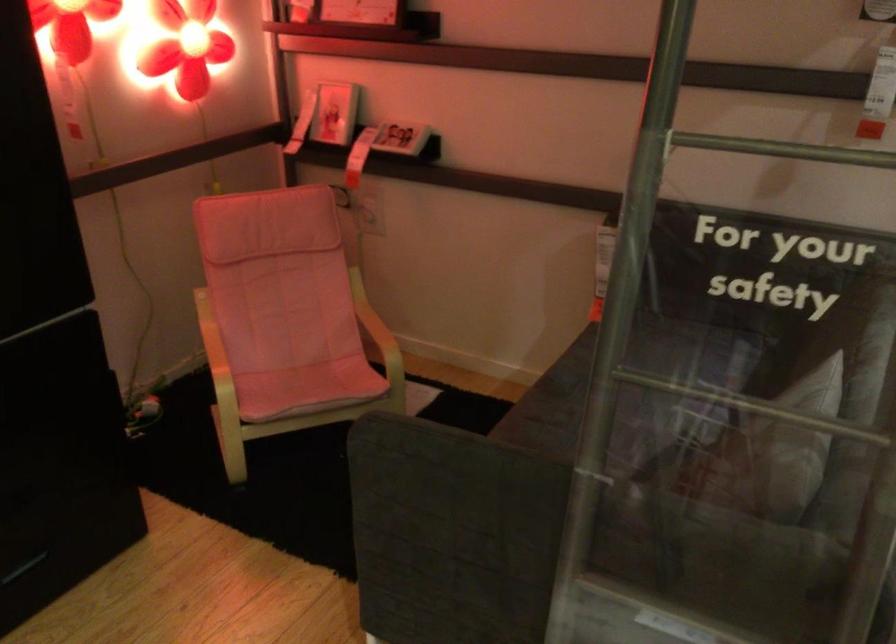
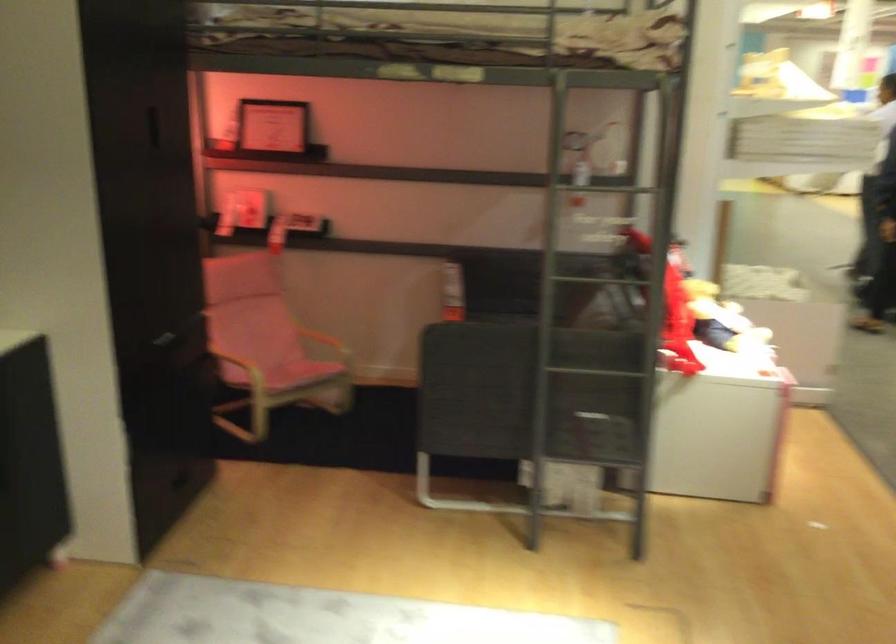
The point at (431,305) is marked in the first image. Where is the corresponding point in the second image?

(332, 328)